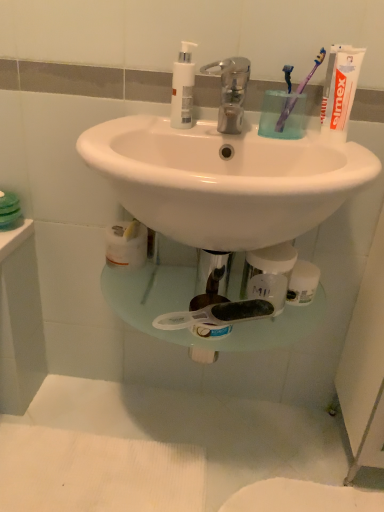
Image resolution: width=384 pixels, height=512 pixels. I want to click on free point to the left of metallic faucet at center, so click(x=168, y=129).